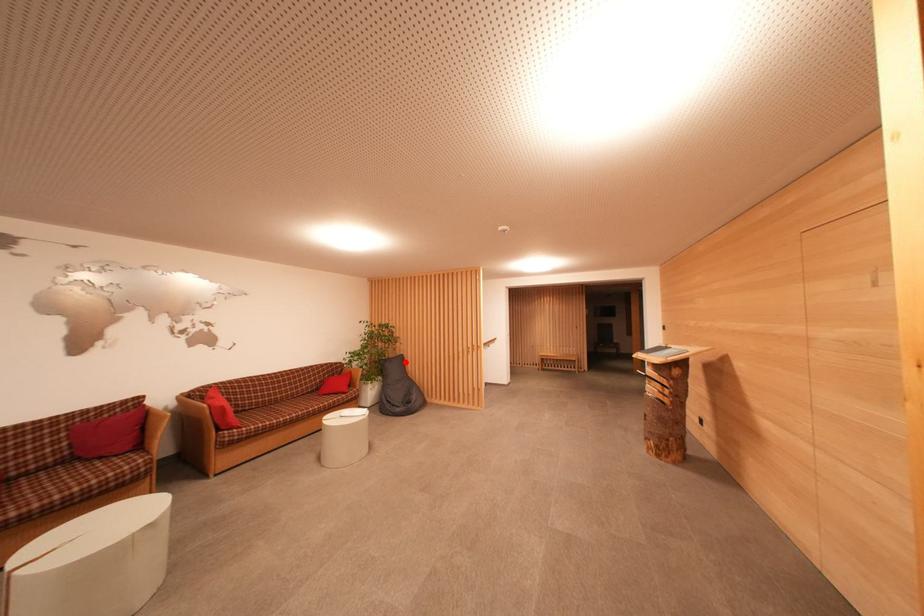
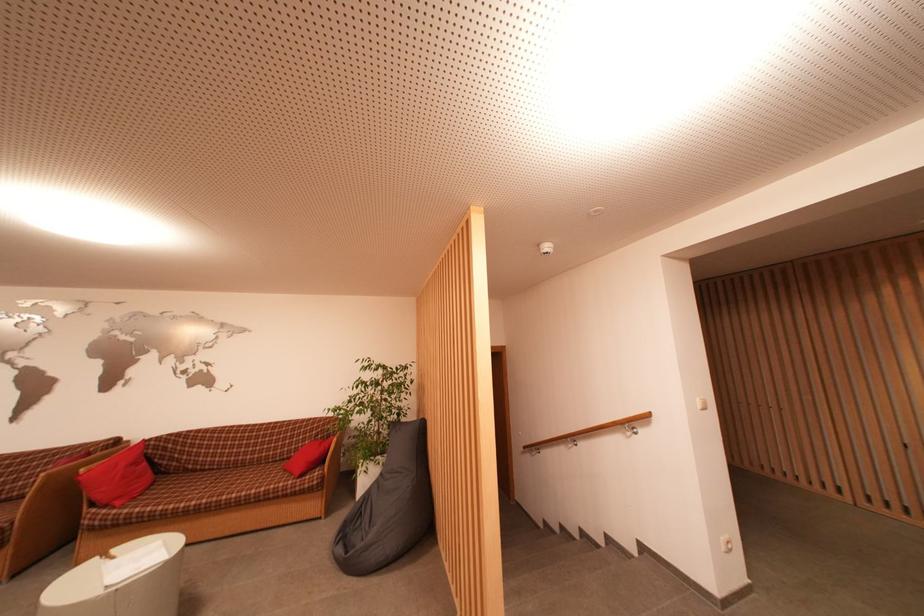
Where in the second image is the point corresponding to the highlighted location from the first image?

(426, 430)